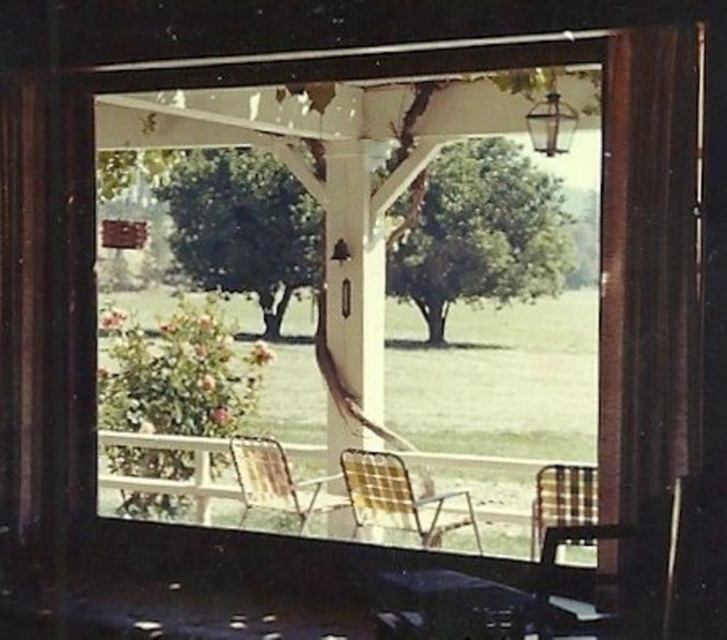
Is plaid fabric chair at right to the right of plaid fabric rocking chair at lower right from the viewer's perspective?

Correct, you'll find plaid fabric chair at right to the right of plaid fabric rocking chair at lower right.

Is plaid fabric chair at right closer to camera compared to plaid fabric rocking chair at lower right?

That is False.

The width and height of the screenshot is (727, 640). In order to click on plaid fabric chair at right in this screenshot , I will do `click(562, 500)`.

Which is behind, point (156, 484) or point (670, 531)?

Positioned behind is point (156, 484).

At what (x,y) coordinates should I click in order to perform the action: click on plaid fabric chairs at center. Please return your answer as a coordinate pair (x, y). The height and width of the screenshot is (640, 727). Looking at the image, I should click on (169, 480).

Does plaid fabric chair at center have a greater height compared to rustic wood chair at center?

Yes.

Is plaid fabric chair at center below rustic wood chair at center?

Correct, plaid fabric chair at center is located below rustic wood chair at center.

Which is in front, point (371, 518) or point (284, 492)?

Point (371, 518) is in front.

In order to click on plaid fabric chair at center in this screenshot , I will do `click(398, 497)`.